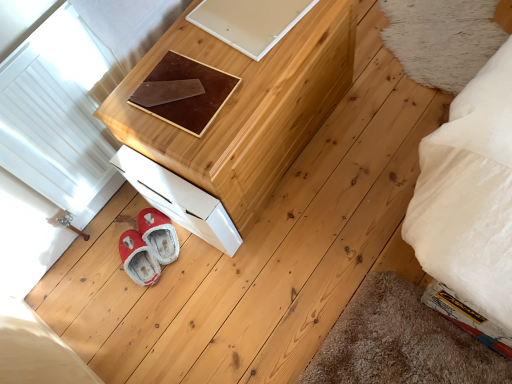
Find the location of a particular element. This screenshot has height=384, width=512. vacant space behind fuzzy red slippers at lower left is located at coordinates (120, 218).